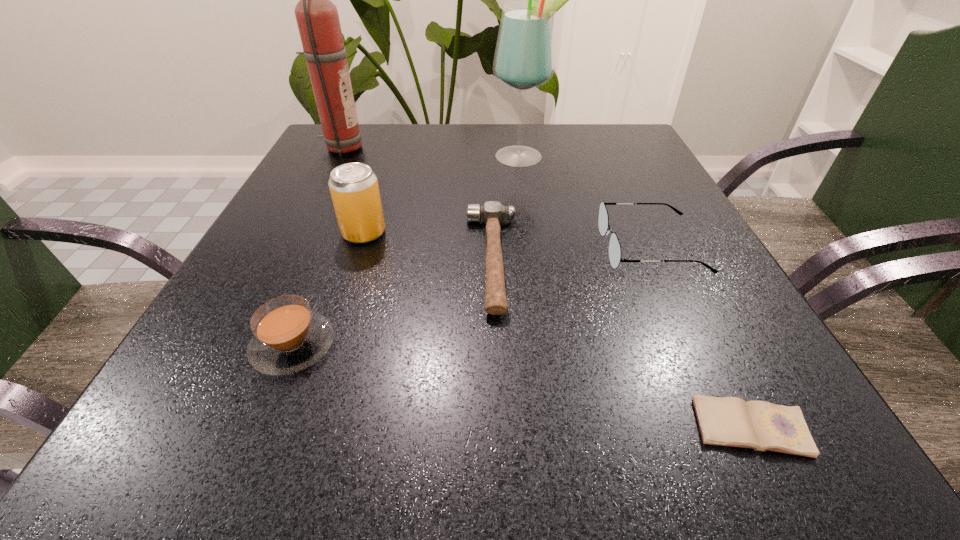
The image size is (960, 540). I want to click on vacant space positioned on the front of the third tallest object, so click(x=345, y=292).

You are a GUI agent. You are given a task and a screenshot of the screen. Output one action in this format:
    pyautogui.click(x=<x>, y=<y>)
    Task: Click on the free space located on the back of the cappuccino
    This screenshot has height=540, width=960.
    Given the screenshot: What is the action you would take?
    pyautogui.click(x=321, y=276)

What are the coordinates of `vacant area situated 0.400m on the lenses of the spectacles` in the screenshot? It's located at (385, 248).

The height and width of the screenshot is (540, 960). I want to click on vacant region located on the lenses of the spectacles, so click(516, 248).

Image resolution: width=960 pixels, height=540 pixels. Find the location of `free space located 0.130m on the lenses of the spectacles`. free space located 0.130m on the lenses of the spectacles is located at coordinates (533, 248).

Where is `vacant space located on the striking face of the second shortest object`? vacant space located on the striking face of the second shortest object is located at coordinates (348, 260).

Where is `vacant space located 0.370m on the striking face of the second shortest object`? Image resolution: width=960 pixels, height=540 pixels. vacant space located 0.370m on the striking face of the second shortest object is located at coordinates (256, 260).

Locate an element on the screen. free region located 0.260m on the striking face of the second shortest object is located at coordinates (319, 260).

Where is `vacant space located 0.060m on the back of the shortest object`? The width and height of the screenshot is (960, 540). vacant space located 0.060m on the back of the shortest object is located at coordinates (718, 361).

Where is `alcohol located at the far edge`? The image size is (960, 540). alcohol located at the far edge is located at coordinates 524,59.